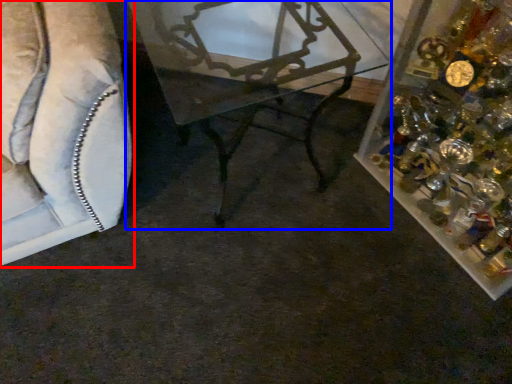
Question: Which object is further to the camera taking this photo, furniture (highlighted by a red box) or table (highlighted by a blue box)?

Choices:
 (A) furniture
 (B) table

Answer: (B)